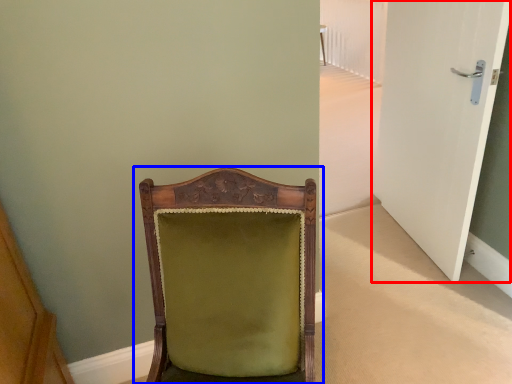
Question: Which point is closer to the camera, door (highlighted by a red box) or chair (highlighted by a blue box)?

Choices:
 (A) door
 (B) chair

Answer: (B)